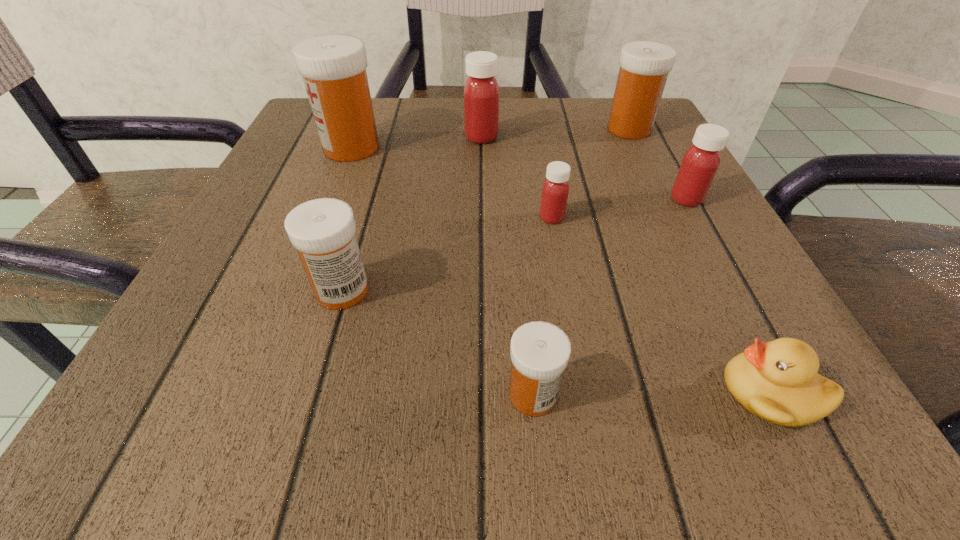
You are a GUI agent. You are given a task and a screenshot of the screen. Output one action in this format:
    pyautogui.click(x=<x>, y=<y>)
    Task: Click on the smallest red medicine
    
    Given the screenshot: What is the action you would take?
    pyautogui.click(x=555, y=190)

This screenshot has width=960, height=540. What are the coordinates of `the smallest white medicine` in the screenshot? It's located at (540, 351).

Locate an element on the screen. The width and height of the screenshot is (960, 540). the nearest medicine is located at coordinates 540,351.

Where is `duckling`? This screenshot has height=540, width=960. duckling is located at coordinates (777, 381).

Find the location of a particular element. vacant space located on the back of the tallest object is located at coordinates (364, 116).

The height and width of the screenshot is (540, 960). I want to click on free space located 0.090m on the left of the rightmost white medicine, so click(x=561, y=129).

At what (x,y) coordinates should I click in order to perform the action: click on vacant space positioned on the back of the farthest red medicine. Please return your answer as a coordinate pair (x, y). The width and height of the screenshot is (960, 540). Looking at the image, I should click on (481, 115).

Where is `vacant space situated 0.350m on the left of the second farthest red medicine`? The image size is (960, 540). vacant space situated 0.350m on the left of the second farthest red medicine is located at coordinates (454, 199).

Identify the location of vacant space situated 0.070m on the left of the sixth farthest medicine. This screenshot has height=540, width=960. (260, 290).

Where is `vacant point located on the front of the smallest red medicine`? The height and width of the screenshot is (540, 960). vacant point located on the front of the smallest red medicine is located at coordinates (564, 284).